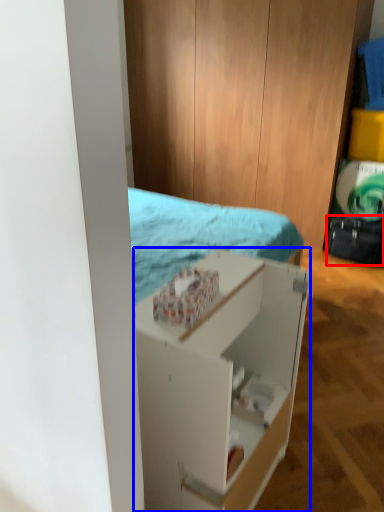
Question: Which point is further to the camera, luggage (highlighted by a red box) or shelf (highlighted by a blue box)?

Choices:
 (A) luggage
 (B) shelf

Answer: (A)